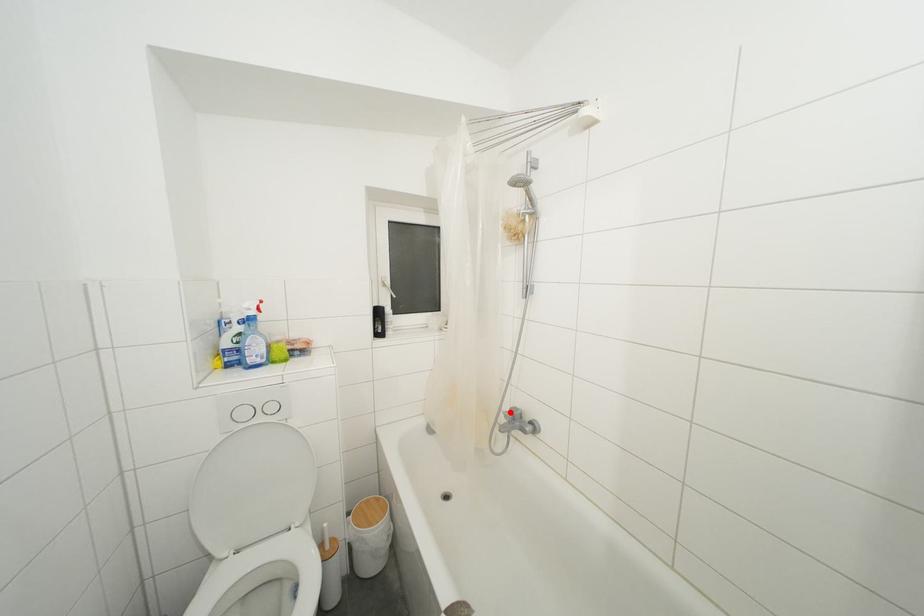
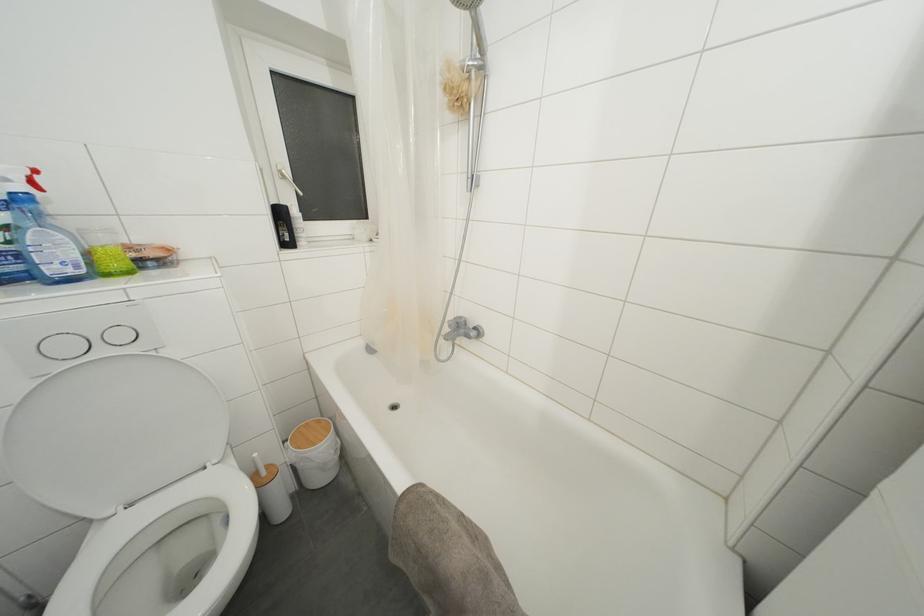
Question: A red point is marked in image1. In image2, is the corresponding 3D point closer to the camera or farther? Reply with the corresponding letter.

Choices:
 (A) The corresponding 3D point is closer.
 (B) The corresponding 3D point is farther.

Answer: (A)